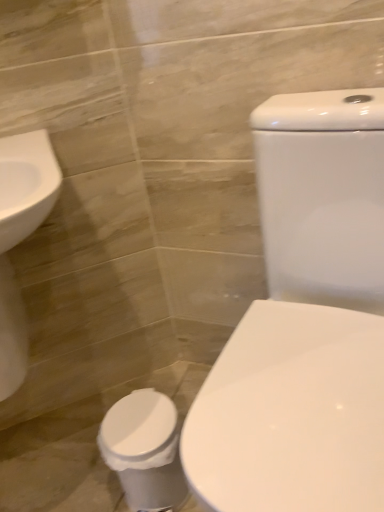
At what (x,y) coordinates should I click in order to perform the action: click on white glossy toilet bowl at lower left. Please return your answer as a coordinate pair (x, y). The image size is (384, 512). Looking at the image, I should click on (144, 449).

In order to face white glossy toilet bowl at lower left, should I rotate leftwards or rightwards?

Turn left approximately 6.374 degrees to face it.

The height and width of the screenshot is (512, 384). What do you see at coordinates (144, 449) in the screenshot?
I see `white glossy toilet bowl at lower left` at bounding box center [144, 449].

Where is `white glossy toilet at center`? The width and height of the screenshot is (384, 512). white glossy toilet at center is located at coordinates (304, 323).

What do you see at coordinates (304, 323) in the screenshot? This screenshot has height=512, width=384. I see `white glossy toilet at center` at bounding box center [304, 323].

In order to click on white glossy toilet bowl at lower left in this screenshot , I will do `click(144, 449)`.

Considering the positions of objects white glossy toilet bowl at lower left and white glossy toilet at center in the image provided, who is more to the right, white glossy toilet bowl at lower left or white glossy toilet at center?

From the viewer's perspective, white glossy toilet at center appears more on the right side.

Is white glossy toilet bowl at lower left further to the viewer compared to white glossy toilet at center?

Yes, the depth of white glossy toilet bowl at lower left is greater than that of white glossy toilet at center.

Which is behind, point (170, 448) or point (334, 131)?

The point (170, 448) is more distant.

From the image's perspective, is white glossy toilet bowl at lower left on top of white glossy toilet at center?

No, from the image's perspective, white glossy toilet bowl at lower left is not on top of white glossy toilet at center.

From a real-world perspective, which object rests below the other?

white glossy toilet bowl at lower left is physically lower.

Is white glossy toilet bowl at lower left thinner than white glossy toilet at center?

Yes, white glossy toilet bowl at lower left is thinner than white glossy toilet at center.

Considering the relative sizes of white glossy toilet bowl at lower left and white glossy toilet at center in the image provided, is white glossy toilet bowl at lower left taller than white glossy toilet at center?

No.

Between white glossy toilet bowl at lower left and white glossy toilet at center, which one has larger size?

white glossy toilet at center.

Is white glossy toilet at center a part of white glossy toilet bowl at lower left?

No.

Is white glossy toilet bowl at lower left with white glossy toilet at center?

No, white glossy toilet bowl at lower left is not beside white glossy toilet at center.

Is white glossy toilet bowl at lower left aimed at white glossy toilet at center?

No, white glossy toilet bowl at lower left is not facing towards white glossy toilet at center.

At what (x,y) coordinates should I click in order to perform the action: click on toilet lying on the right of white glossy toilet bowl at lower left. Please return your answer as a coordinate pair (x, y). This screenshot has height=512, width=384. Looking at the image, I should click on (304, 323).

Considering the relative positions of white glossy toilet at center and white glossy toilet bowl at lower left in the image provided, is white glossy toilet at center to the left or to the right of white glossy toilet bowl at lower left?

Based on their positions, white glossy toilet at center is located to the right of white glossy toilet bowl at lower left.

Does white glossy toilet at center lie in front of white glossy toilet bowl at lower left?

That is True.

Between point (349, 420) and point (172, 440), which one is positioned behind?

The point (172, 440) is more distant.

From the image's perspective, is white glossy toilet at center positioned above or below white glossy toilet bowl at lower left?

white glossy toilet at center is situated higher than white glossy toilet bowl at lower left in the image.

From a real-world perspective, which is physically above, white glossy toilet at center or white glossy toilet bowl at lower left?

white glossy toilet at center, from a real-world perspective.

Looking at this image, in terms of width, does white glossy toilet at center look wider or thinner when compared to white glossy toilet bowl at lower left?

white glossy toilet at center is wider than white glossy toilet bowl at lower left.

Is white glossy toilet at center taller than white glossy toilet bowl at lower left?

Correct, white glossy toilet at center is much taller as white glossy toilet bowl at lower left.

Can you confirm if white glossy toilet at center is smaller than white glossy toilet bowl at lower left?

Actually, white glossy toilet at center might be larger than white glossy toilet bowl at lower left.

In the scene shown: Is white glossy toilet at center not inside white glossy toilet bowl at lower left?

That's correct, white glossy toilet at center is outside of white glossy toilet bowl at lower left.

Does white glossy toilet at center touch white glossy toilet bowl at lower left?

No, white glossy toilet at center is not next to white glossy toilet bowl at lower left.

Is white glossy toilet at center facing towards white glossy toilet bowl at lower left?

No, white glossy toilet at center does not turn towards white glossy toilet bowl at lower left.

This screenshot has width=384, height=512. I want to click on toilet bowl that appears behind the white glossy toilet at center, so click(x=144, y=449).

Identify the location of toilet that appears above the white glossy toilet bowl at lower left (from the image's perspective). (304, 323).

Find the location of `toilet located on the right of white glossy toilet bowl at lower left`. toilet located on the right of white glossy toilet bowl at lower left is located at coordinates (304, 323).